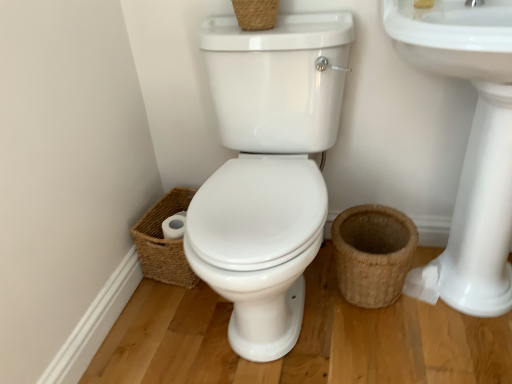
Identify the location of vacant space in front of woven brown basket at upper center, which is the 2th basket in right-to-left order. The height and width of the screenshot is (384, 512). (265, 38).